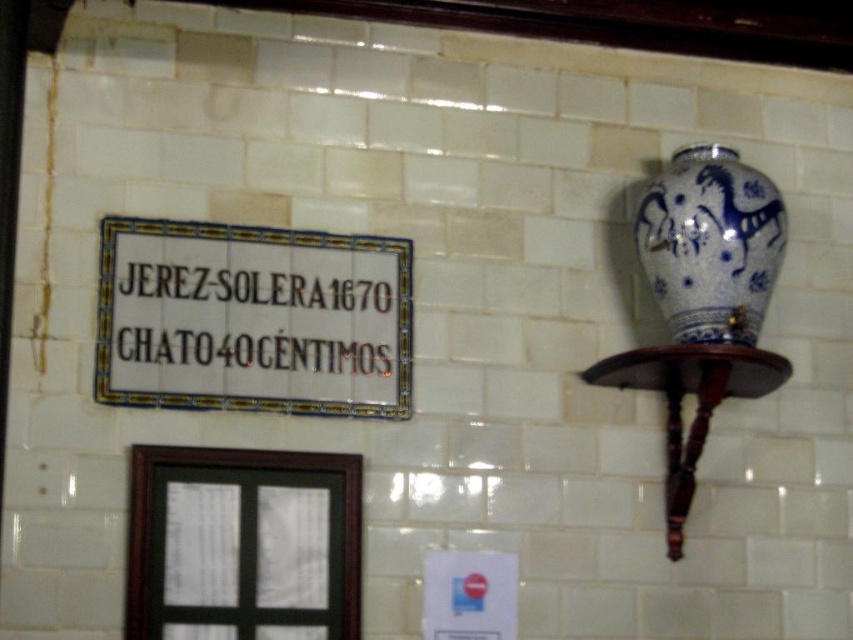
You are an interior designer arranging items on a white tiled wall. You have a white ceramic sign at upper left and a blue and white ceramic vase at upper right. Based on the scene description, which object is positioned to the left of the other?

The white ceramic sign at upper left is positioned to the left of the blue and white ceramic vase at upper right.

You are an interior designer planning to add a new decorative element between the white ceramic sign at upper left and the blue and white ceramic vase at upper right on the tiled wall. Considering their sizes, which object should you place closer to the center of the wall to maintain balance?

The white ceramic sign at upper left is larger than the blue and white ceramic vase at upper right. To maintain balance, place the larger white ceramic sign at upper left closer to the center, while positioning the smaller vase farther away.

You are an interior designer arranging items on a white tiled wall. You have the white ceramic sign at upper left and the blue and white ceramic vase at upper right. Which object is taller?

The blue and white ceramic vase at upper right is taller than the white ceramic sign at upper left.